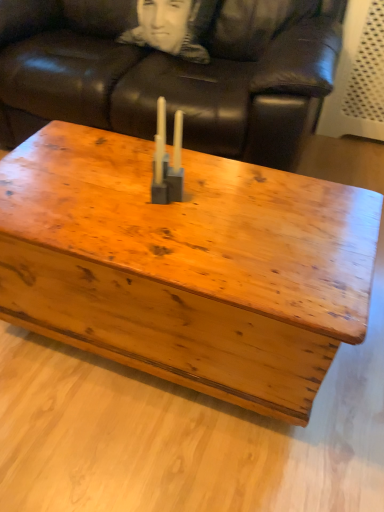
I want to click on free space that is to the left of matte gray plastic candle holder at center, so click(x=102, y=196).